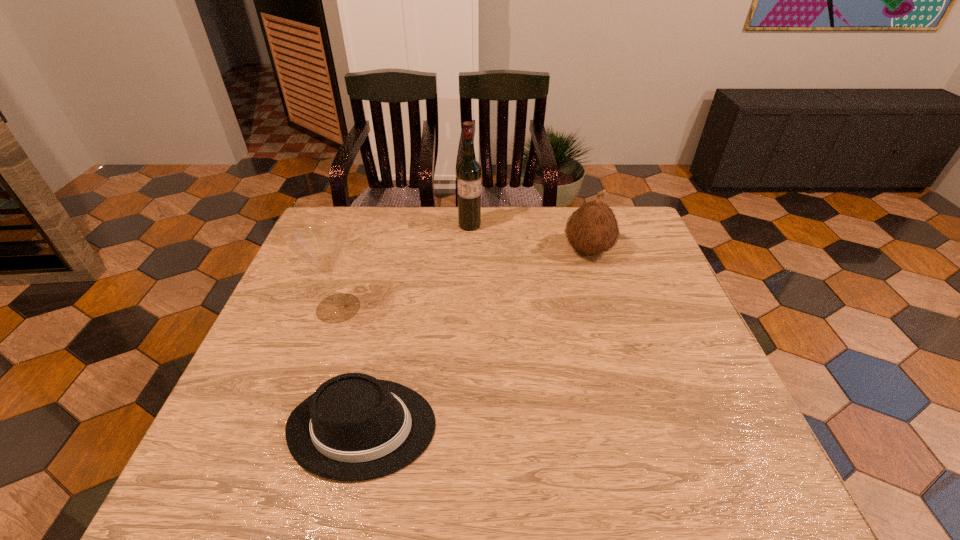
This screenshot has height=540, width=960. In order to click on the second object from right to left in this screenshot , I will do `click(468, 171)`.

Find the location of a particular element. The height and width of the screenshot is (540, 960). wine bottle is located at coordinates (468, 171).

Locate an element on the screen. The width and height of the screenshot is (960, 540). the rightmost object is located at coordinates (592, 229).

Find the location of a particular element. This screenshot has width=960, height=540. the third nearest object is located at coordinates (592, 229).

The image size is (960, 540). In order to click on the third farthest object in this screenshot , I will do `click(321, 244)`.

Find the location of `the shortest object`. the shortest object is located at coordinates (354, 427).

Locate an element on the screen. Image resolution: width=960 pixels, height=540 pixels. the nearest object is located at coordinates (354, 427).

This screenshot has width=960, height=540. I want to click on vacant space located 0.190m on the front and back of the tallest object, so click(468, 270).

Locate an element on the screen. Image resolution: width=960 pixels, height=540 pixels. free space located on the surface of the third nearest object is located at coordinates (450, 250).

Locate an element on the screen. vacant space located on the surface of the third nearest object is located at coordinates (519, 250).